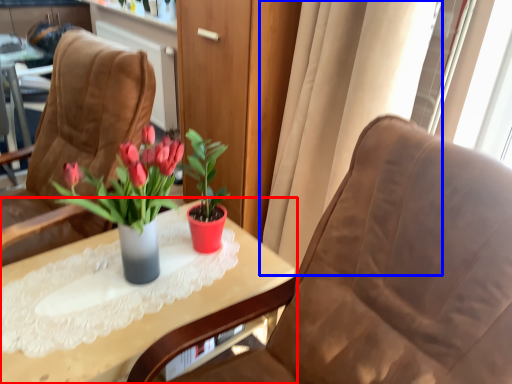
Question: Among these objects, which one is nearest to the camera, table (highlighted by a red box) or curtain (highlighted by a blue box)?

Choices:
 (A) table
 (B) curtain

Answer: (A)